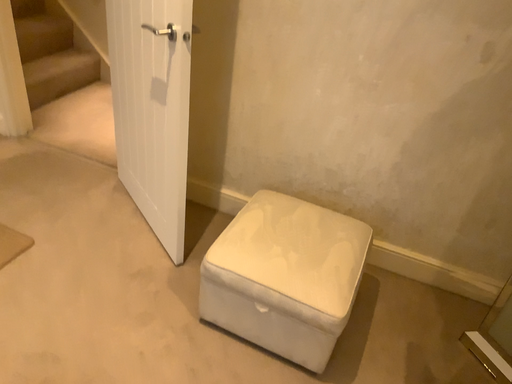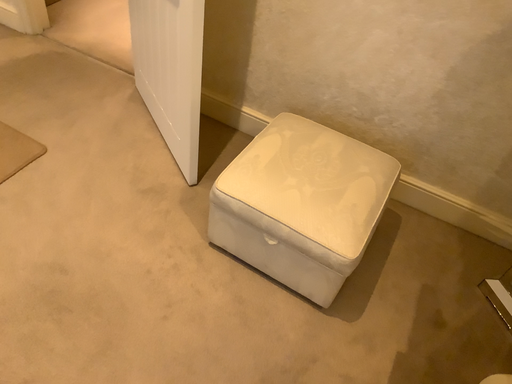
Question: Which way did the camera rotate in the video?

Choices:
 (A) rotated downward
 (B) rotated upward

Answer: (A)